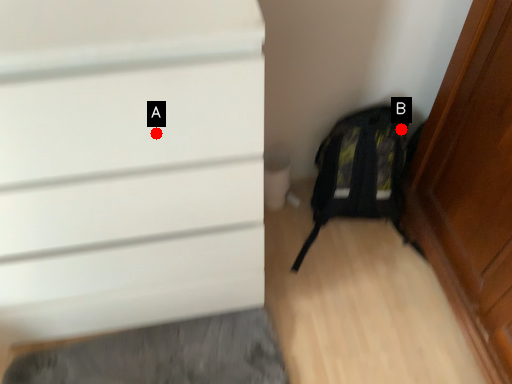
Question: Two points are circled on the image, labeled by A and B beside each circle. Which point is closer to the camera taking this photo?

Choices:
 (A) A is closer
 (B) B is closer

Answer: (A)